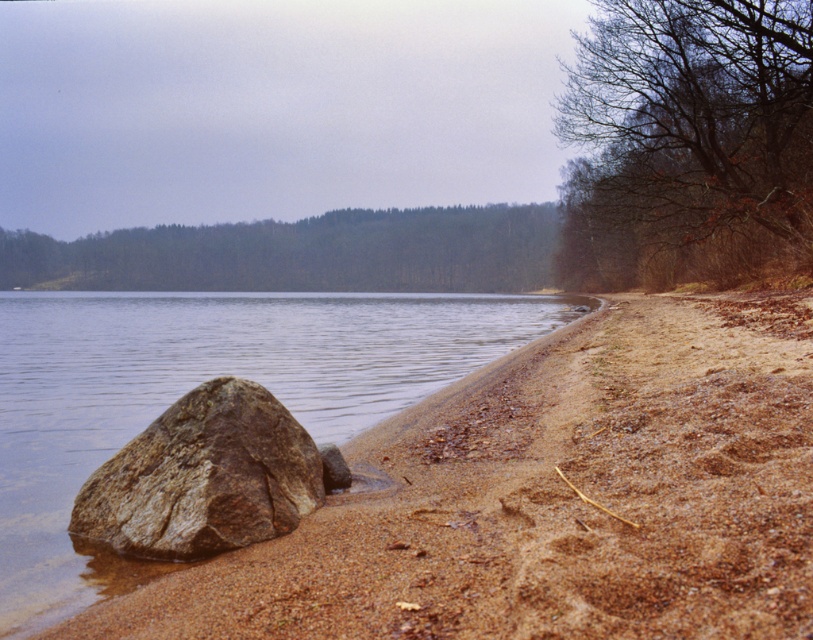
You are standing on the lakeside and want to walk towards the green leafy forest at upper center and the brown rough rock at lower left. Which object will you reach first?

You will reach the brown rough rock at lower left first because it is closer to you than the green leafy forest at upper center, which is further away.

You are standing on the sandy beach and want to walk towards the brown leafy tree at upper right. Which direction should you move relative to the clear water at shore left?

To reach the brown leafy tree at upper right, you should move away from the clear water at shore left since the tree is further from the viewer compared to the water.

You are standing on the sandy beach and want to find the clear water to take a photo. According to the coordinates provided, where should you look for the clear water at shore left?

The clear water at shore left is located at the 2D coordinates point (193,387).